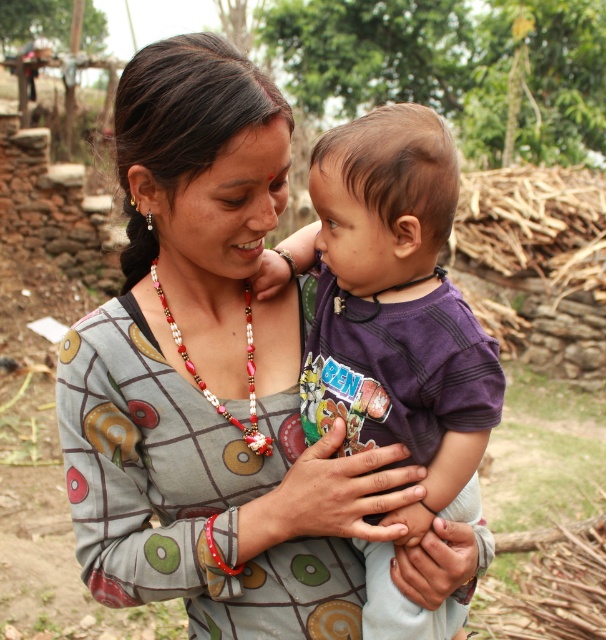
Which of these two, printed fabric dress at center or beaded necklace at center, stands shorter?

Standing shorter between the two is beaded necklace at center.

The height and width of the screenshot is (640, 606). What do you see at coordinates (210, 378) in the screenshot? I see `printed fabric dress at center` at bounding box center [210, 378].

Locate an element on the screen. This screenshot has height=640, width=606. printed fabric dress at center is located at coordinates (210, 378).

Looking at this image, which is more to the right, printed fabric dress at center or purple cotton shirt at center?

Positioned to the right is purple cotton shirt at center.

Which of these two, printed fabric dress at center or purple cotton shirt at center, stands shorter?

Standing shorter between the two is purple cotton shirt at center.

This screenshot has width=606, height=640. Describe the element at coordinates (210, 378) in the screenshot. I see `printed fabric dress at center` at that location.

Locate an element on the screen. The height and width of the screenshot is (640, 606). printed fabric dress at center is located at coordinates (210, 378).

Does purple cotton shirt at center have a smaller size compared to beaded necklace at center?

Actually, purple cotton shirt at center might be larger than beaded necklace at center.

Does purple cotton shirt at center have a greater width compared to beaded necklace at center?

Indeed, purple cotton shirt at center has a greater width compared to beaded necklace at center.

Is point (350, 381) positioned behind point (175, 340)?

No, it is not.

Identify the location of purple cotton shirt at center. (396, 308).